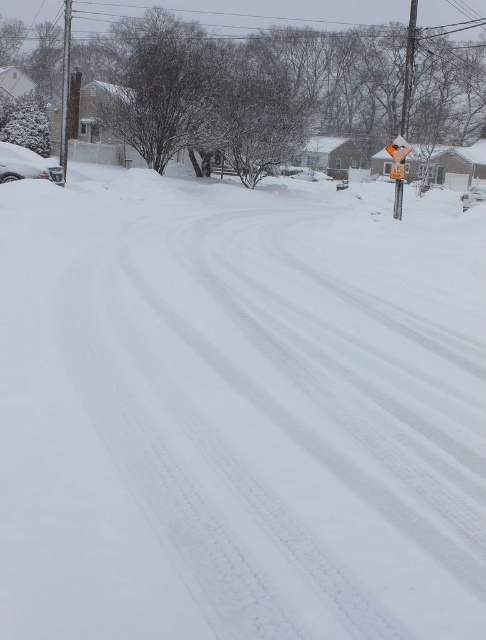
Question: Which point is farther from the camera taking this photo?

Choices:
 (A) (476, 186)
 (B) (398, 148)

Answer: (A)

Question: Does yellow plastic diamond-shaped sign at upper right have a lesser width compared to white matte car at center?

Choices:
 (A) yes
 (B) no

Answer: (A)

Question: Does yellow plastic diamond-shaped sign at upper right have a smaller size compared to white matte car at center?

Choices:
 (A) yes
 (B) no

Answer: (A)

Question: Which point is closer to the camera taking this photo?

Choices:
 (A) click(x=396, y=204)
 (B) click(x=469, y=198)

Answer: (A)

Question: Does yellow plastic diamond-shaped sign at upper right have a lesser width compared to white matte car at center?

Choices:
 (A) yes
 (B) no

Answer: (A)